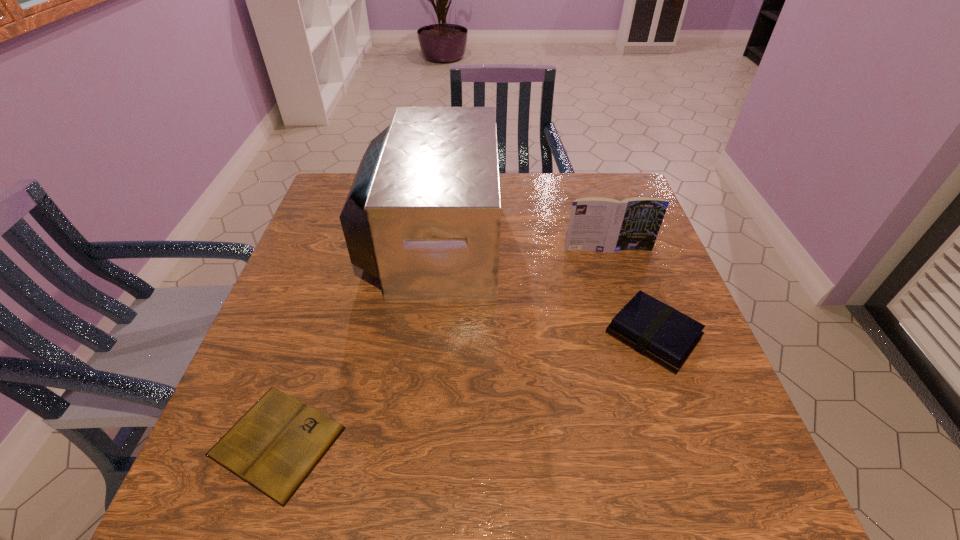
I want to click on free location located 0.400m on the back of the nearest book, so click(342, 254).

Where is `object located at the far edge`? This screenshot has height=540, width=960. object located at the far edge is located at coordinates (423, 215).

Locate an element on the screen. Image resolution: width=960 pixels, height=540 pixels. object that is at the near edge is located at coordinates (274, 447).

Locate an element on the screen. This screenshot has height=540, width=960. object located in the left edge section of the desktop is located at coordinates (274, 447).

The image size is (960, 540). In order to click on object that is positioned at the near left corner in this screenshot , I will do `click(274, 447)`.

This screenshot has width=960, height=540. I want to click on vacant space at the far edge of the desktop, so click(x=514, y=214).

Find the location of a particular element. free spot at the near edge of the desktop is located at coordinates (581, 464).

The height and width of the screenshot is (540, 960). In the image, there is a desktop. Identify the location of vacant area at the left edge. (300, 255).

The image size is (960, 540). In the image, there is a desktop. In order to click on free space at the right edge in this screenshot , I will do `click(703, 347)`.

The image size is (960, 540). Identify the location of vacant area at the far left corner. (341, 186).